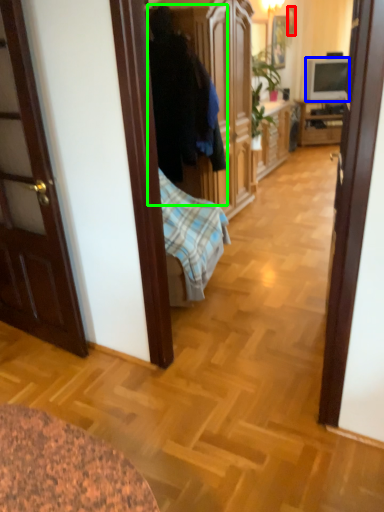
Question: Which is nearer to the picture frame (highlighted by a red box)? television (highlighted by a blue box) or person (highlighted by a green box).

Choices:
 (A) television
 (B) person

Answer: (A)